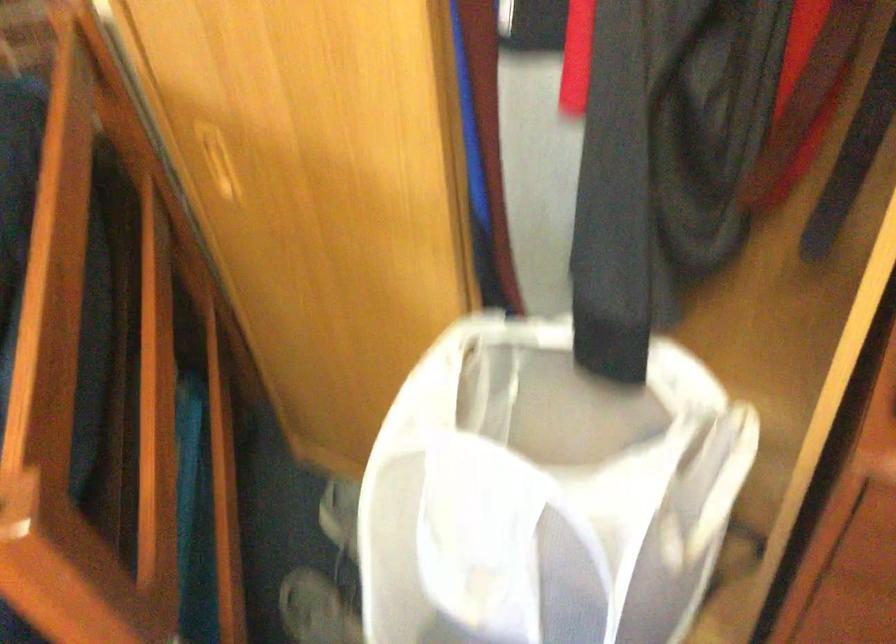
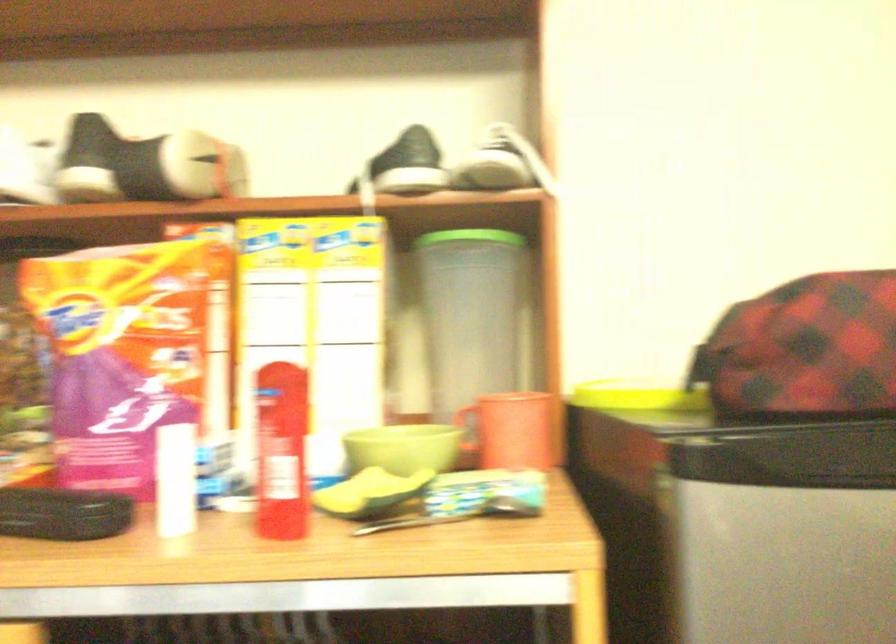
Looking at this image, the images are taken continuously from a first-person perspective. In which direction is your viewpoint rotating?

The camera's rotation is toward right-up.